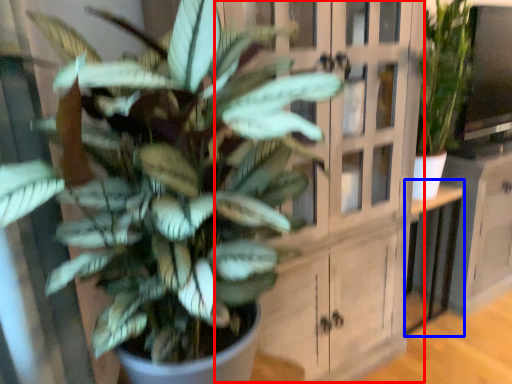
Question: Which point is further to the camera, dresser (highlighted by a red box) or table (highlighted by a blue box)?

Choices:
 (A) dresser
 (B) table

Answer: (B)